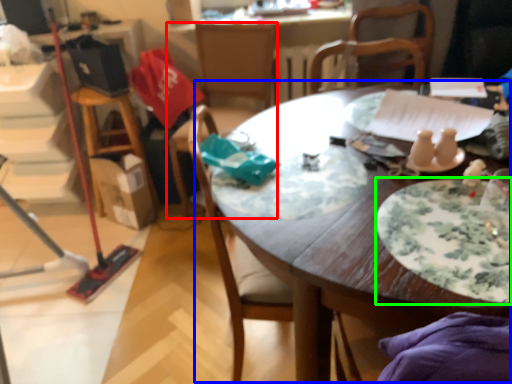
Question: Based on their relative distances, which object is farther from chair (highlighted by a red box)? Choose from table (highlighted by a blue box) and plate (highlighted by a green box).

Choices:
 (A) table
 (B) plate

Answer: (B)